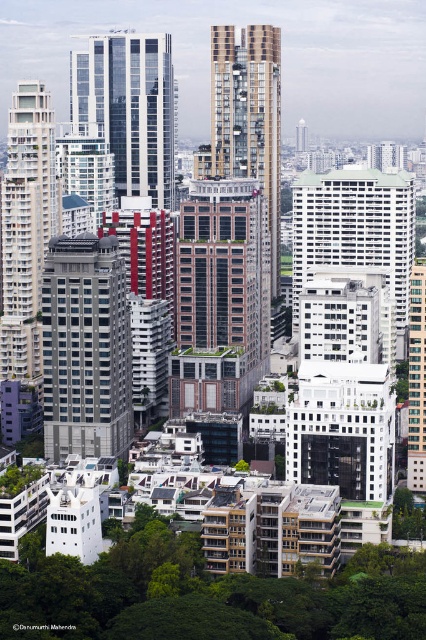
Question: Is white glossy building at center bigger than white glossy building at left?

Choices:
 (A) no
 (B) yes

Answer: (B)

Question: Among these objects, which one is nearest to the camera?

Choices:
 (A) white glossy building at left
 (B) brown brick building at center
 (C) glassy reflective building at center
 (D) matte gray building at center

Answer: (B)

Question: Among these points, which one is farthest from the camera?

Choices:
 (A) (135, 132)
 (B) (31, 259)
 (C) (307, 276)

Answer: (A)

Question: Is matte gray building at center smaller than gold textured building at center?

Choices:
 (A) yes
 (B) no

Answer: (A)

Question: Can you confirm if brown brick building at center is positioned below glassy reflective building at center?

Choices:
 (A) no
 (B) yes

Answer: (B)

Question: Which of these objects is positioned closest to the matte gray building at center?

Choices:
 (A) brown brick building at center
 (B) gold textured building at center
 (C) white glossy building at left

Answer: (C)